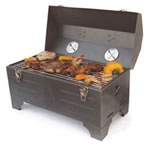
At what (x,y) coordinates should I click in order to perform the action: click on latches. Please return your answer as a coordinate pair (x, y). The height and width of the screenshot is (147, 150). Looking at the image, I should click on (18, 76), (83, 92).